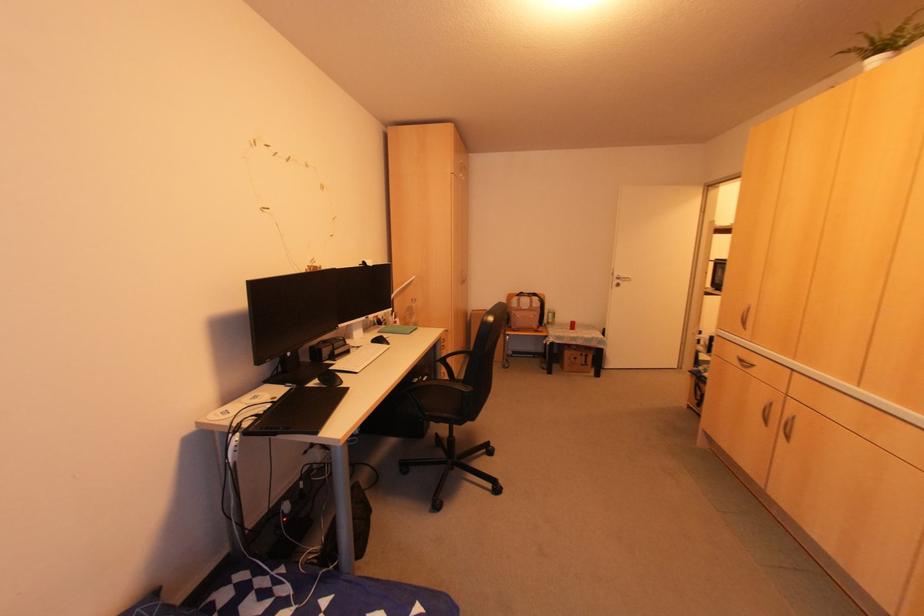
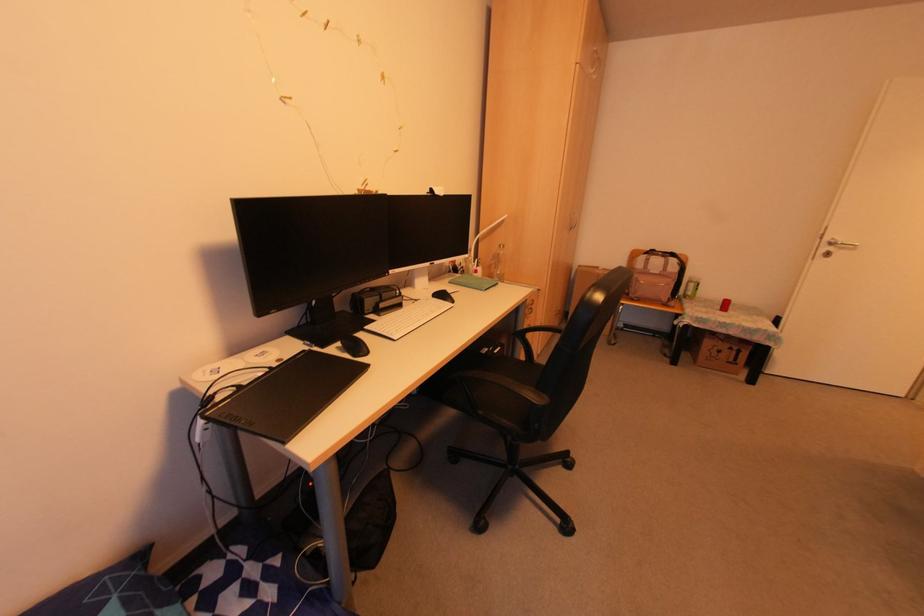
In the second image, find the point that corresponds to point (441, 361) in the first image.

(518, 334)